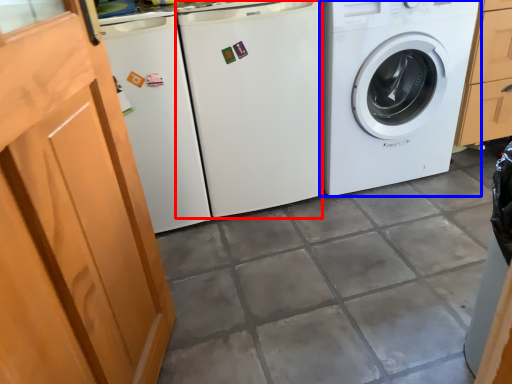
Question: Which object appears farthest to the camera in this image, washing machine (highlighted by a red box) or washing machine (highlighted by a blue box)?

Choices:
 (A) washing machine
 (B) washing machine

Answer: (B)